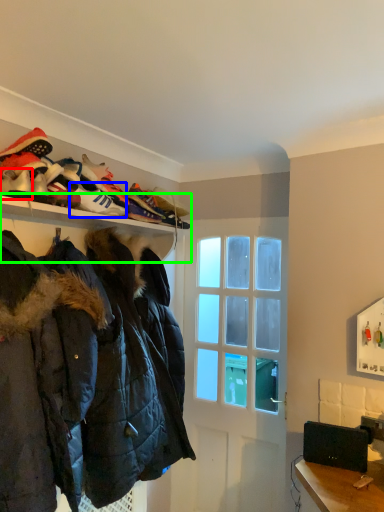
Question: Which is nearer to the footwear (highlighted by a red box)? shoe (highlighted by a blue box) or shelf (highlighted by a green box).

Choices:
 (A) shoe
 (B) shelf

Answer: (A)